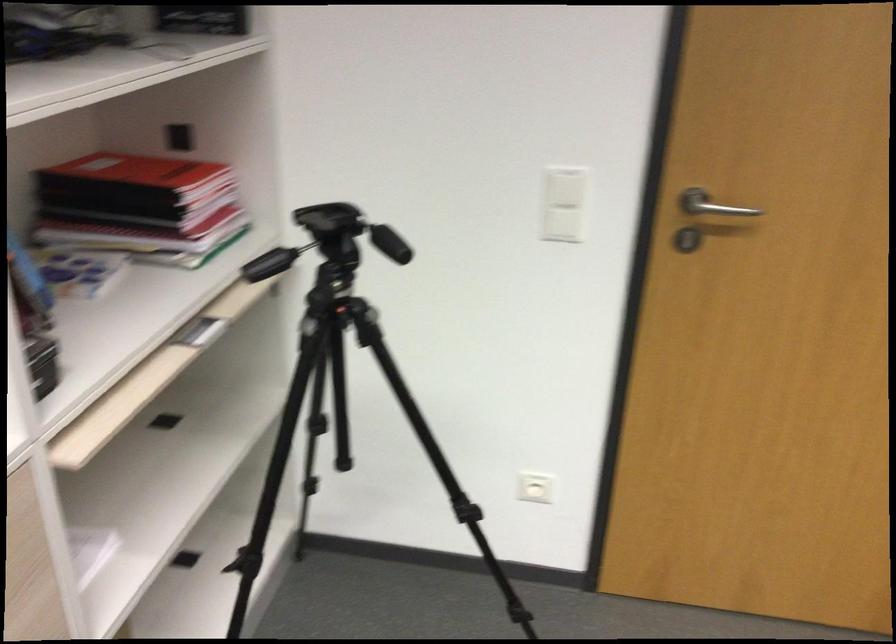
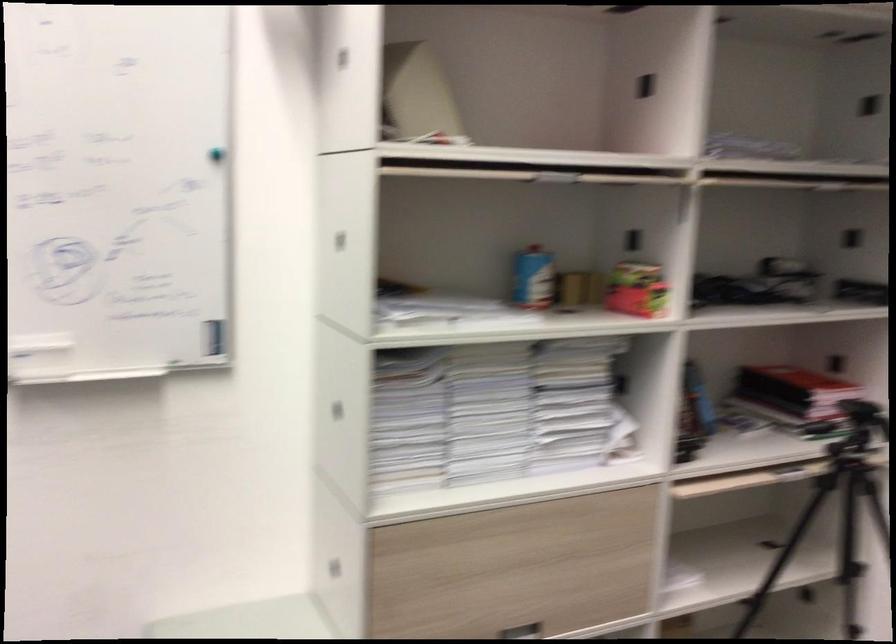
The point at (x=147, y=221) is marked in the first image. Where is the corresponding point in the second image?

(793, 398)